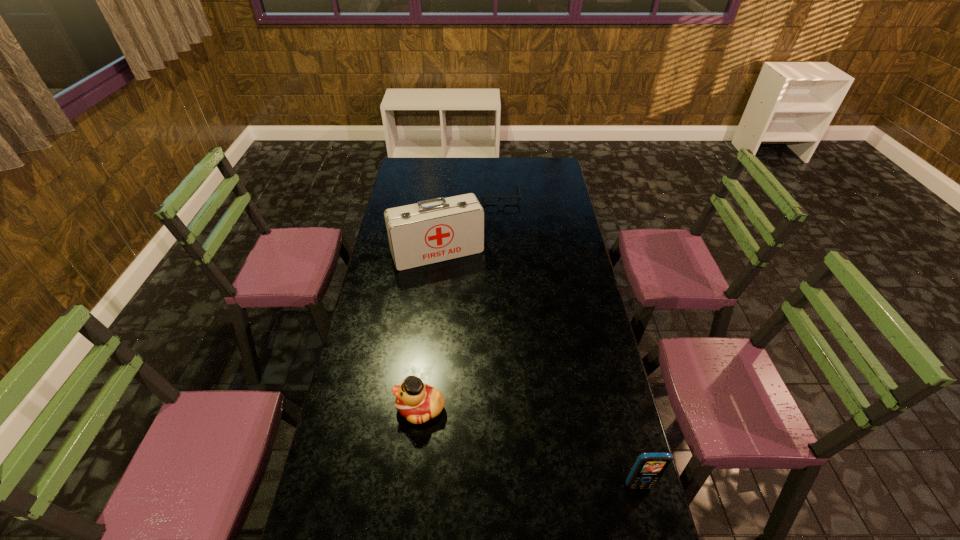
Where is `vacant space on the desktop that is between the second shortest object and the cellular telephone and is positioned on the front-facing side of the tallest object`? This screenshot has width=960, height=540. vacant space on the desktop that is between the second shortest object and the cellular telephone and is positioned on the front-facing side of the tallest object is located at coordinates (516, 442).

I want to click on free space on the desktop that is between the duck and the cellular telephone and is positioned on the front-facing side of the farthest object, so click(516, 442).